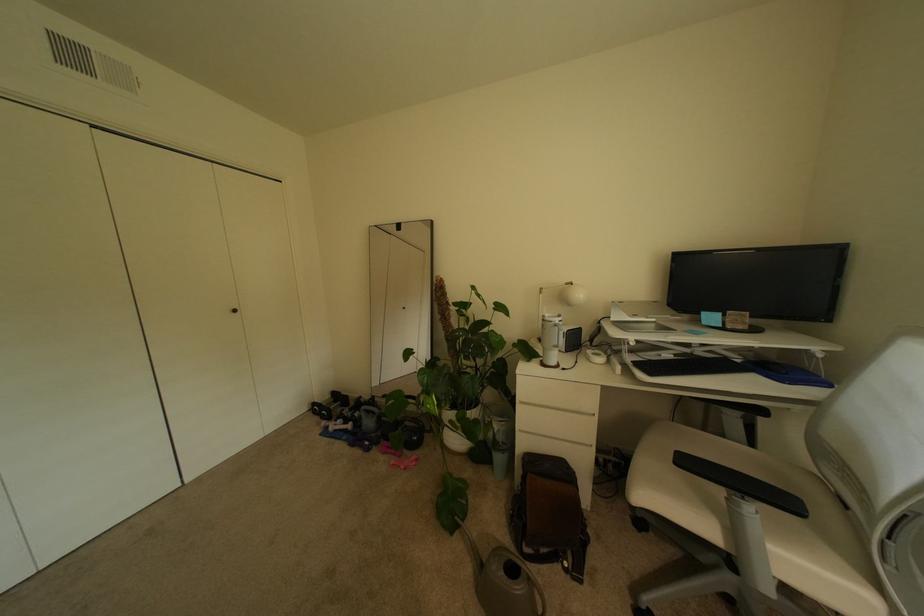
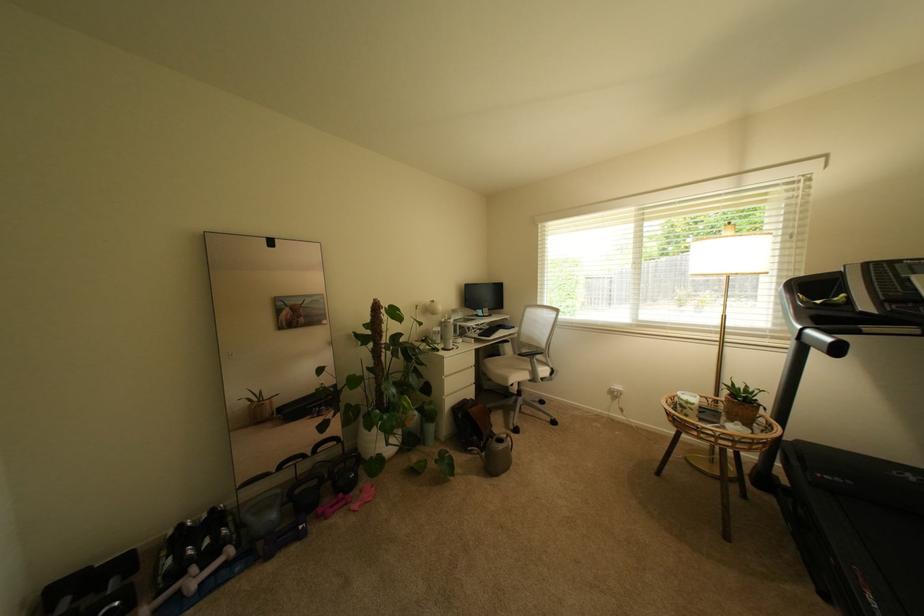
The point at (x=369, y=399) is marked in the first image. Where is the corresponding point in the second image?

(188, 527)